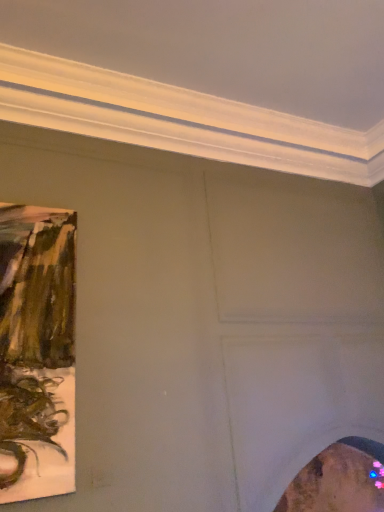
Question: From the image's perspective, is wooden frame at lower right, which ranks as the first picture frame in bottom-to-top order, above matte brown painting at left, which is the first picture frame in front-to-back order?

Choices:
 (A) no
 (B) yes

Answer: (A)

Question: Is matte brown painting at left, which is the first picture frame in front-to-back order, a part of wooden frame at lower right, the 2th picture frame viewed from the left?

Choices:
 (A) no
 (B) yes

Answer: (A)

Question: Is wooden frame at lower right, which ranks as the first picture frame in right-to-left order, positioned far away from matte brown painting at left, which is the 2th picture frame in back-to-front order?

Choices:
 (A) yes
 (B) no

Answer: (A)

Question: Does wooden frame at lower right, which is the 2th picture frame in front-to-back order, appear on the right side of matte brown painting at left, which is the first picture frame in front-to-back order?

Choices:
 (A) no
 (B) yes

Answer: (B)

Question: Does wooden frame at lower right, arranged as the 1th picture frame when viewed from the back, have a greater width compared to matte brown painting at left, positioned as the first picture frame in top-to-bottom order?

Choices:
 (A) yes
 (B) no

Answer: (A)

Question: Can you confirm if wooden frame at lower right, arranged as the 1th picture frame when viewed from the back, is taller than matte brown painting at left, the second picture frame in the right-to-left sequence?

Choices:
 (A) yes
 (B) no

Answer: (B)

Question: Is matte brown painting at left, the second picture frame in the right-to-left sequence, not close to wooden frame at lower right, which ranks as the first picture frame in bottom-to-top order?

Choices:
 (A) no
 (B) yes

Answer: (B)

Question: Is matte brown painting at left, which is the 2th picture frame in back-to-front order, outside of wooden frame at lower right, which ranks as the first picture frame in right-to-left order?

Choices:
 (A) no
 (B) yes

Answer: (B)

Question: Can you confirm if matte brown painting at left, the 1th picture frame positioned from the left, is positioned to the left of wooden frame at lower right, arranged as the 1th picture frame when viewed from the back?

Choices:
 (A) no
 (B) yes

Answer: (B)

Question: Is matte brown painting at left, the 1th picture frame positioned from the left, in contact with wooden frame at lower right, which is the 2th picture frame in front-to-back order?

Choices:
 (A) no
 (B) yes

Answer: (A)

Question: From the image's perspective, is matte brown painting at left, which is the 2th picture frame in back-to-front order, under wooden frame at lower right, the 2th picture frame viewed from the left?

Choices:
 (A) no
 (B) yes

Answer: (A)

Question: Is matte brown painting at left, which is the first picture frame in front-to-back order, looking in the opposite direction of wooden frame at lower right, which is the 2th picture frame in front-to-back order?

Choices:
 (A) no
 (B) yes

Answer: (A)

Question: In the image, is matte brown painting at left, which is the 2th picture frame from bottom to top, positioned in front of or behind wooden frame at lower right, which ranks as the first picture frame in bottom-to-top order?

Choices:
 (A) front
 (B) behind

Answer: (A)